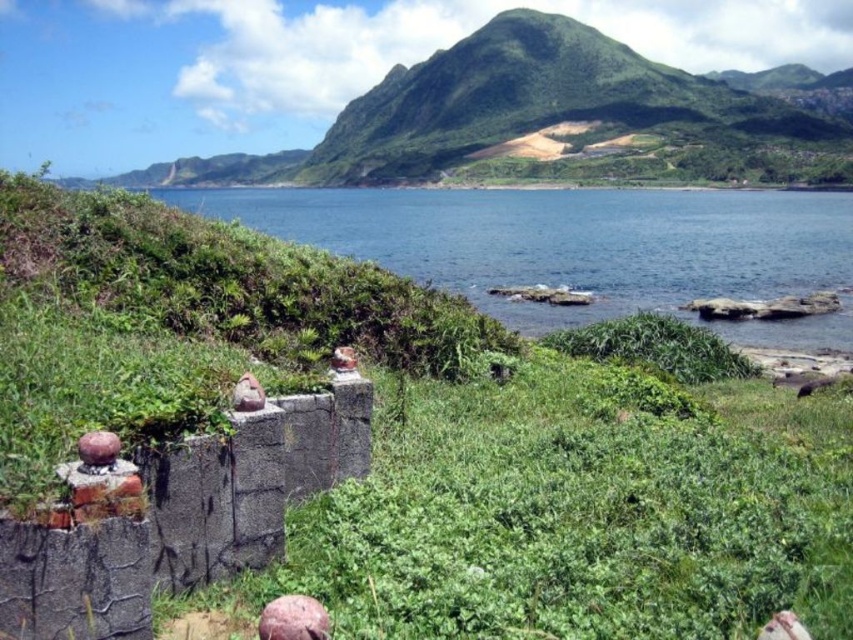
Question: Is green grassy mountain at upper center further to camera compared to blue water at center?

Choices:
 (A) no
 (B) yes

Answer: (B)

Question: Which of the following is the closest to the observer?

Choices:
 (A) blue water at center
 (B) green grassy mountain at upper center

Answer: (A)

Question: Which point appears closest to the camera in this image?

Choices:
 (A) (601, 164)
 (B) (587, 227)

Answer: (B)

Question: Can you confirm if green grassy mountain at upper center is positioned to the left of blue water at center?

Choices:
 (A) no
 (B) yes

Answer: (B)

Question: Is green grassy mountain at upper center further to the viewer compared to blue water at center?

Choices:
 (A) no
 (B) yes

Answer: (B)